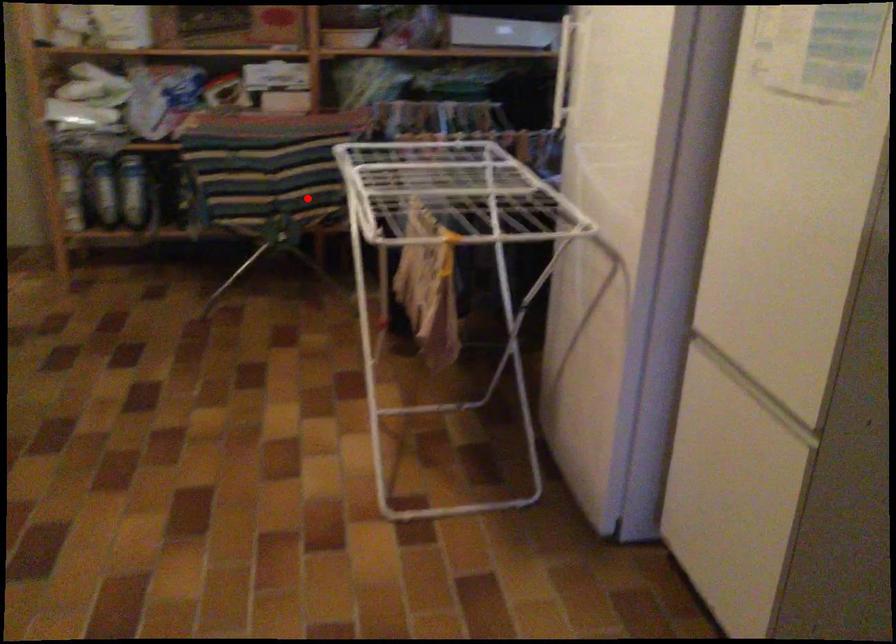
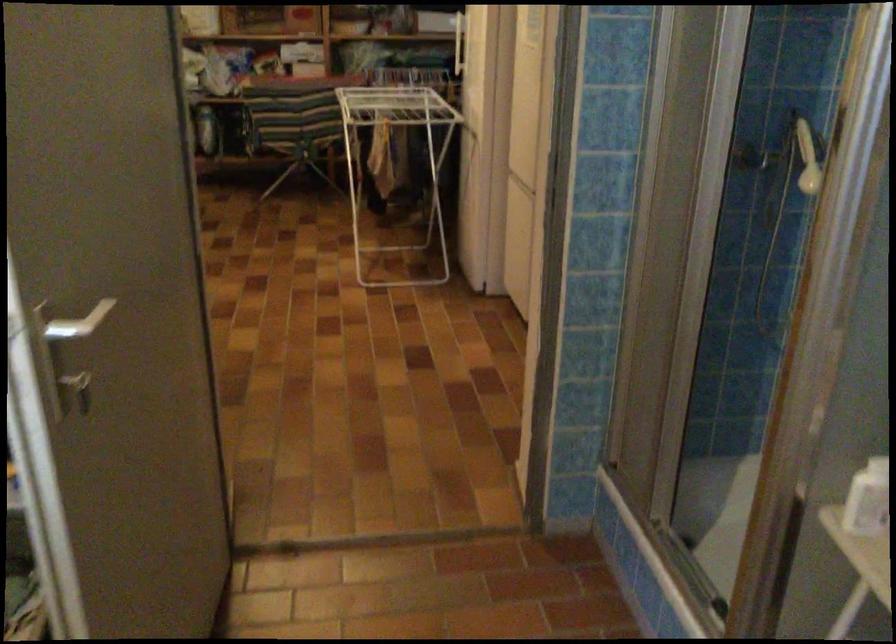
Locate, in the second image, the point that corresponds to the highlighted location in the first image.

(306, 128)